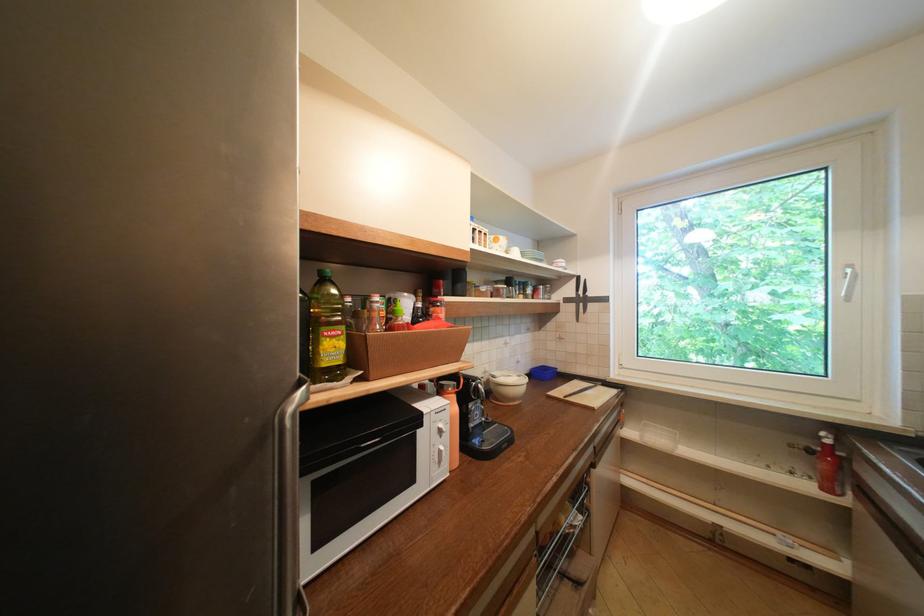
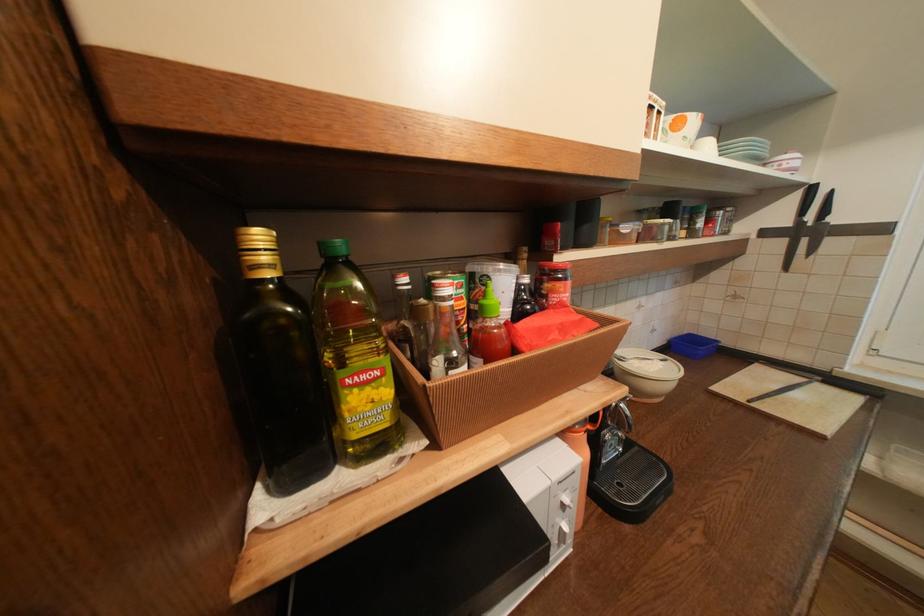
Locate, in the second image, the point that corresponds to point 554,373 in the first image.

(709, 349)